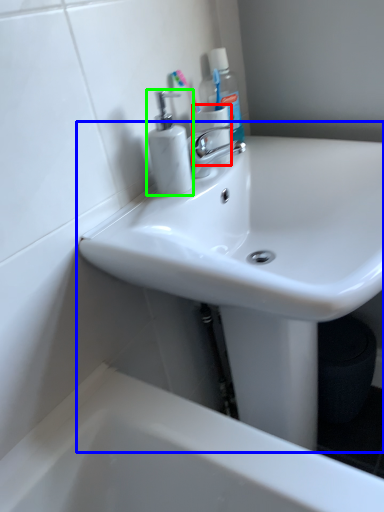
Question: Which object is the farthest from toilet paper (highlighted by a red box)? Choose among these: sink (highlighted by a blue box) or soap dispenser (highlighted by a green box).

Choices:
 (A) sink
 (B) soap dispenser

Answer: (A)